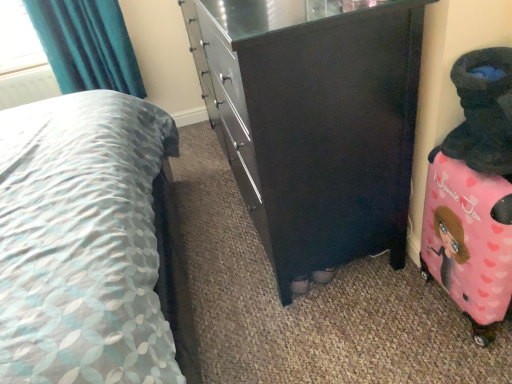
Identify the location of patterned fabric bed at center. (82, 241).

Describe the element at coordinates (28, 86) in the screenshot. I see `white plastic radiator at upper left` at that location.

Locate an element on the screen. The height and width of the screenshot is (384, 512). patterned fabric bed at center is located at coordinates (82, 241).

From the image's perspective, which object appears higher, teal fabric curtain at upper left or matte black dresser at center?

teal fabric curtain at upper left.

Is teal fabric curtain at upper left not inside matte black dresser at center?

teal fabric curtain at upper left is positioned outside matte black dresser at center.

Is teal fabric curtain at upper left smaller than matte black dresser at center?

Yes, teal fabric curtain at upper left is smaller than matte black dresser at center.

What's the angular difference between matte black dresser at center and white plastic radiator at upper left's facing directions?

The angle between the facing direction of matte black dresser at center and the facing direction of white plastic radiator at upper left is 89.3 degrees.

Does point (230, 60) appear closer or farther from the camera than point (7, 100)?

Point (230, 60) appears to be closer to the viewer than point (7, 100).

From the image's perspective, which one is positioned lower, matte black dresser at center or white plastic radiator at upper left?

matte black dresser at center appears lower in the image.

In the scene shown: Does matte black dresser at center have a lesser width compared to white plastic radiator at upper left?

No.

From the image's perspective, is patterned fabric bed at center positioned above or below teal fabric curtain at upper left?

Clearly, from the image's perspective, patterned fabric bed at center is below teal fabric curtain at upper left.

From the picture: What's the angular difference between patterned fabric bed at center and teal fabric curtain at upper left's facing directions?

patterned fabric bed at center and teal fabric curtain at upper left are facing 90.4 degrees away from each other.

Image resolution: width=512 pixels, height=384 pixels. I want to click on bed located on the right of teal fabric curtain at upper left, so click(82, 241).

Considering the sizes of objects patterned fabric bed at center and matte black dresser at center in the image provided, who is shorter, patterned fabric bed at center or matte black dresser at center?

matte black dresser at center is shorter.

Considering the sizes of objects patterned fabric bed at center and matte black dresser at center in the image provided, who is bigger, patterned fabric bed at center or matte black dresser at center?

patterned fabric bed at center.

Where is `the chest of drawers beneath the patterned fabric bed at center (from a real-world perspective)`? This screenshot has width=512, height=384. the chest of drawers beneath the patterned fabric bed at center (from a real-world perspective) is located at coordinates (315, 124).

Is point (47, 192) behind point (355, 51)?

Yes, point (47, 192) is farther from viewer.

From the image's perspective, is white plastic radiator at upper left located above pink fabric suitcase at right?

Yes, from the image's perspective, white plastic radiator at upper left is on top of pink fabric suitcase at right.

Is white plastic radiator at upper left located outside pink fabric suitcase at right?

white plastic radiator at upper left is positioned outside pink fabric suitcase at right.

Which object is more forward, white plastic radiator at upper left or pink fabric suitcase at right?

pink fabric suitcase at right is in front.

Between matte black dresser at center and teal fabric curtain at upper left, which one has smaller width?

With smaller width is teal fabric curtain at upper left.

Is matte black dresser at center smaller than teal fabric curtain at upper left?

Incorrect, matte black dresser at center is not smaller in size than teal fabric curtain at upper left.

Can you confirm if matte black dresser at center is positioned to the right of teal fabric curtain at upper left?

Yes, matte black dresser at center is to the right of teal fabric curtain at upper left.

Considering their positions, is pink fabric suitcase at right located in front of or behind matte black dresser at center?

pink fabric suitcase at right is positioned farther from the viewer than matte black dresser at center.

What's the angular difference between pink fabric suitcase at right and matte black dresser at center's facing directions?

The facing directions of pink fabric suitcase at right and matte black dresser at center are 0.356 degrees apart.

Based on the photo, does pink fabric suitcase at right have a lesser height compared to matte black dresser at center?

Yes, pink fabric suitcase at right is shorter than matte black dresser at center.

From the image's perspective, is pink fabric suitcase at right on matte black dresser at center?

No, from the image's perspective, pink fabric suitcase at right is not on top of matte black dresser at center.

Where is `curtain lying on the left of matte black dresser at center`? The image size is (512, 384). curtain lying on the left of matte black dresser at center is located at coordinates (86, 45).

Locate an element on the screen. The image size is (512, 384). radiator that is above the matte black dresser at center (from a real-world perspective) is located at coordinates (28, 86).

Considering their positions, is matte black dresser at center positioned further to patterned fabric bed at center than white plastic radiator at upper left?

white plastic radiator at upper left.

Based on the photo, when comparing their distances from white plastic radiator at upper left, does pink fabric suitcase at right or teal fabric curtain at upper left seem closer?

teal fabric curtain at upper left is positioned closer to the anchor white plastic radiator at upper left.

When comparing their distances from teal fabric curtain at upper left, does patterned fabric bed at center or pink fabric suitcase at right seem further?

pink fabric suitcase at right is further to teal fabric curtain at upper left.

From the image, which object appears to be nearer to matte black dresser at center, patterned fabric bed at center or teal fabric curtain at upper left?

The object closer to matte black dresser at center is patterned fabric bed at center.

Which object lies nearer to the anchor point matte black dresser at center, pink fabric suitcase at right or white plastic radiator at upper left?

pink fabric suitcase at right is positioned closer to the anchor matte black dresser at center.

From the image, which object appears to be farther from white plastic radiator at upper left, matte black dresser at center or pink fabric suitcase at right?

Among the two, pink fabric suitcase at right is located further to white plastic radiator at upper left.

Which object lies nearer to the anchor point matte black dresser at center, teal fabric curtain at upper left or white plastic radiator at upper left?

Based on the image, teal fabric curtain at upper left appears to be nearer to matte black dresser at center.

Based on their spatial positions, is patterned fabric bed at center or matte black dresser at center further from white plastic radiator at upper left?

matte black dresser at center is further to white plastic radiator at upper left.

Locate an element on the screen. curtain between white plastic radiator at upper left and pink fabric suitcase at right is located at coordinates (86, 45).

Find the location of `chest of drawers between white plastic radiator at upper left and pink fabric suitcase at right in the horizontal direction`. chest of drawers between white plastic radiator at upper left and pink fabric suitcase at right in the horizontal direction is located at coordinates (315, 124).

This screenshot has height=384, width=512. Find the location of `luggage located between patterned fabric bed at center and teal fabric curtain at upper left in the depth direction`. luggage located between patterned fabric bed at center and teal fabric curtain at upper left in the depth direction is located at coordinates (469, 241).

At what (x,y) coordinates should I click in order to perform the action: click on chest of drawers between patterned fabric bed at center and white plastic radiator at upper left from front to back. Please return your answer as a coordinate pair (x, y). The image size is (512, 384). Looking at the image, I should click on [315, 124].